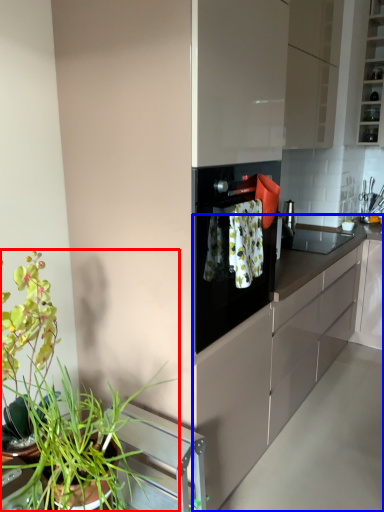
Question: Which object is closer to the camera taking this photo, houseplant (highlighted by a red box) or countertop (highlighted by a blue box)?

Choices:
 (A) houseplant
 (B) countertop

Answer: (A)